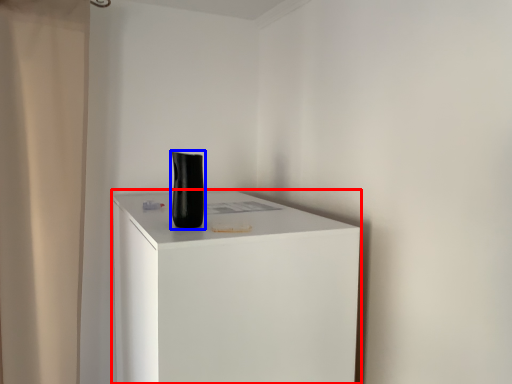
Question: Which object appears closest to the camera in this image, furniture (highlighted by a red box) or vase (highlighted by a blue box)?

Choices:
 (A) furniture
 (B) vase

Answer: (A)